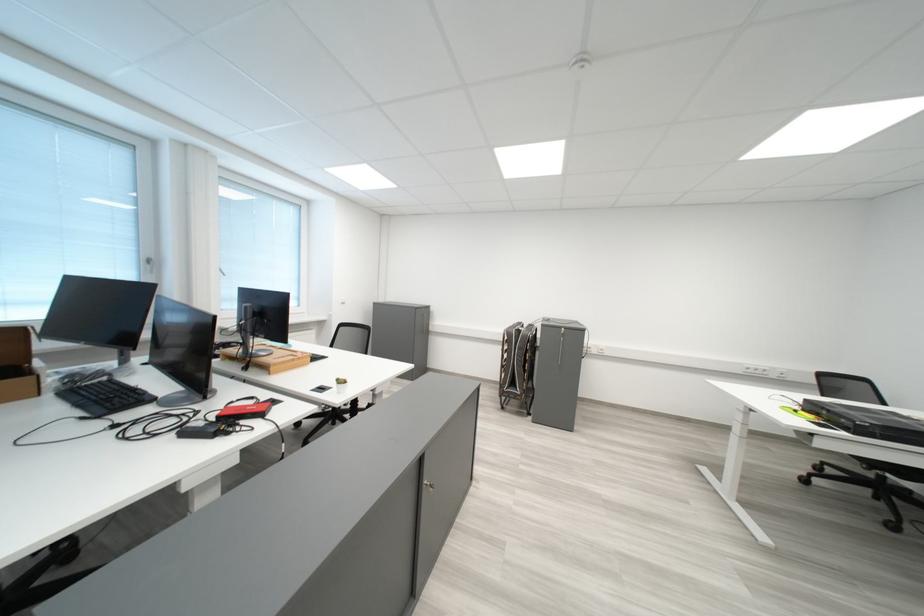
What do you see at coordinates (428, 485) in the screenshot?
I see `a cabinet lock handle` at bounding box center [428, 485].